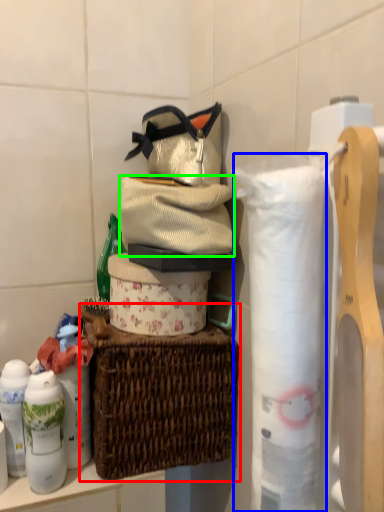
Question: Which object is the farthest from picnic basket (highlighted by a red box)? Choose among these: toilet paper (highlighted by a blue box) or clothing (highlighted by a green box).

Choices:
 (A) toilet paper
 (B) clothing

Answer: (A)